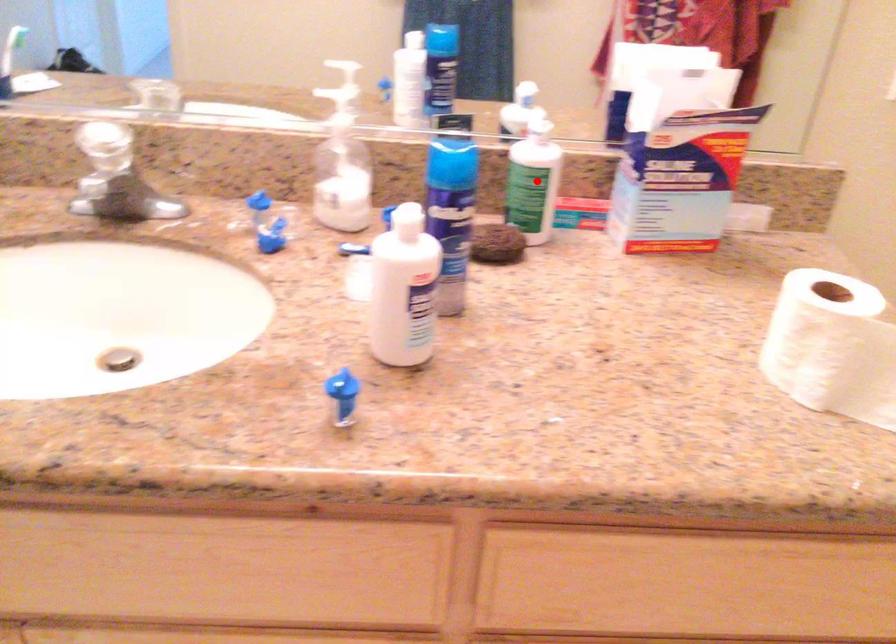
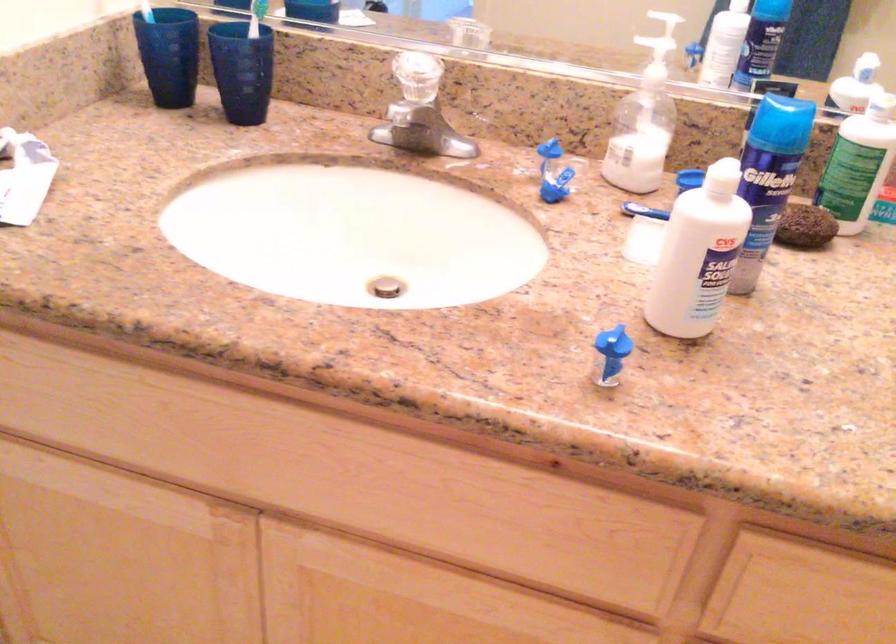
Question: I am providing you with two images of the same scene from different viewpoints. Image1 has a red point marked. In image2, the corresponding 3D location appears at what relative position? Reply with the corresponding letter.

Choices:
 (A) Closer
 (B) Farther

Answer: (A)